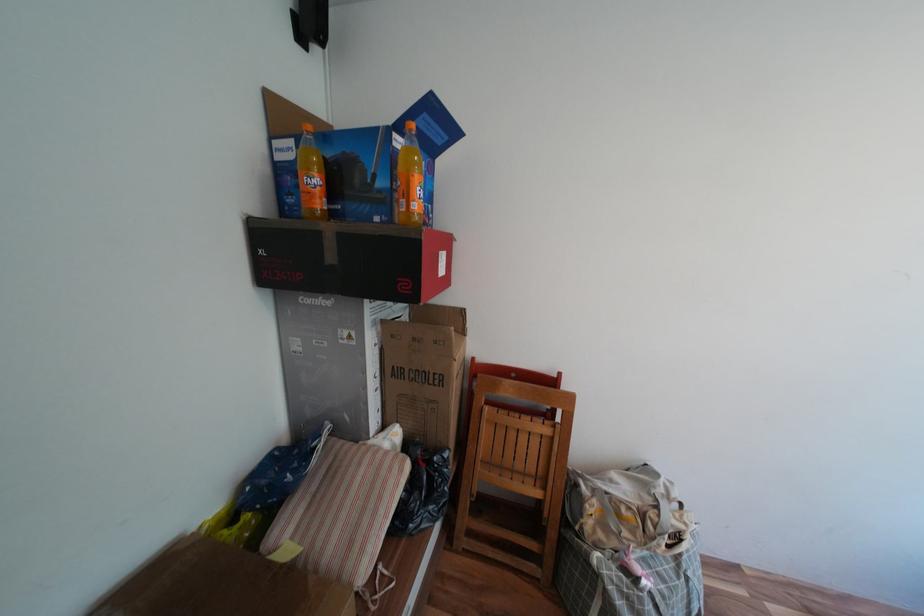
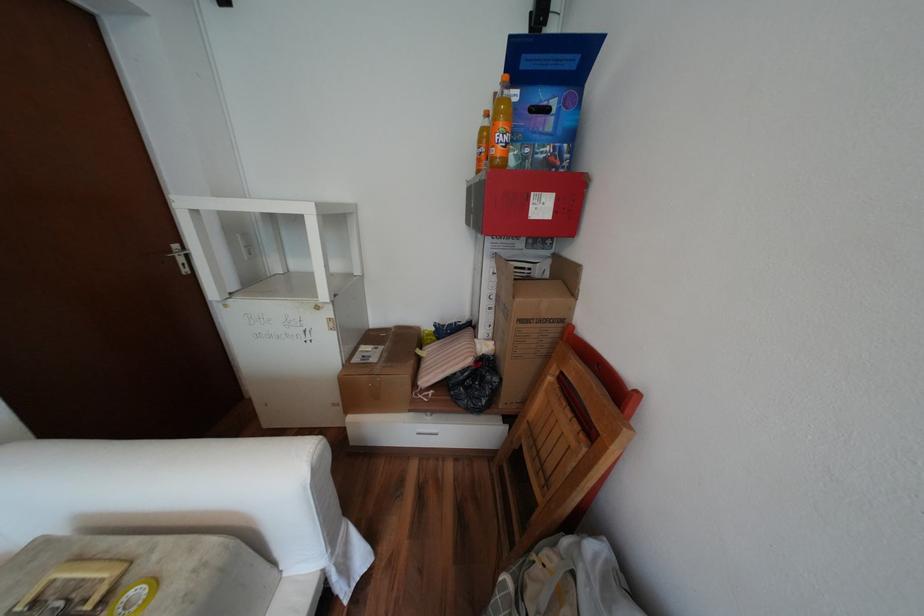
Question: How did the camera likely rotate?

Choices:
 (A) Left
 (B) Right
 (C) Up
 (D) Down

Answer: (A)